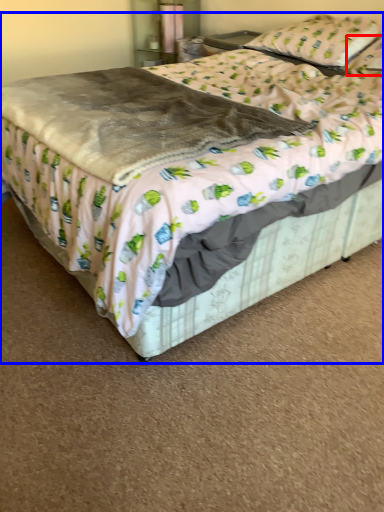
Question: Among these objects, which one is farthest to the camera, pillow (highlighted by a red box) or bed (highlighted by a blue box)?

Choices:
 (A) pillow
 (B) bed

Answer: (A)